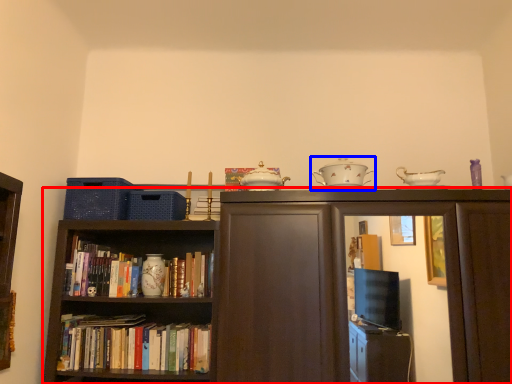
Question: Among these objects, which one is farthest to the camera, bookcase (highlighted by a red box) or tableware (highlighted by a blue box)?

Choices:
 (A) bookcase
 (B) tableware

Answer: (B)